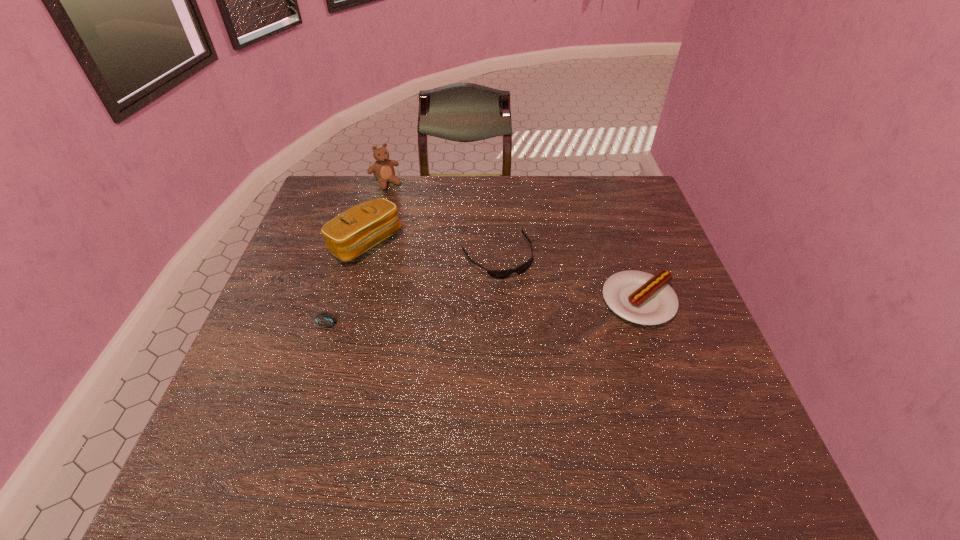
Where is `blank space located on the zipper side of the clutch bag`? The width and height of the screenshot is (960, 540). blank space located on the zipper side of the clutch bag is located at coordinates (488, 344).

The height and width of the screenshot is (540, 960). What are the coordinates of `free spot located 0.320m on the zipper side of the clutch bag` in the screenshot? It's located at (467, 327).

Locate an element on the screen. vacant space situated 0.170m on the zipper side of the clutch bag is located at coordinates (426, 293).

The height and width of the screenshot is (540, 960). I want to click on free spot located on the front-facing side of the teddy bear, so click(402, 203).

The width and height of the screenshot is (960, 540). I want to click on vacant space located 0.310m on the front-facing side of the teddy bear, so click(x=436, y=244).

This screenshot has height=540, width=960. I want to click on free space located 0.170m on the front-facing side of the teddy bear, so click(x=415, y=218).

Identify the location of free space located 0.350m on the front-facing side of the sunglasses. This screenshot has width=960, height=540. (585, 386).

The image size is (960, 540). Find the location of `free space located 0.090m on the front-facing side of the sunglasses`. free space located 0.090m on the front-facing side of the sunglasses is located at coordinates (528, 301).

The height and width of the screenshot is (540, 960). I want to click on free space located 0.170m on the front-facing side of the sunglasses, so click(543, 325).

Where is `object that is at the far edge`? The image size is (960, 540). object that is at the far edge is located at coordinates (383, 169).